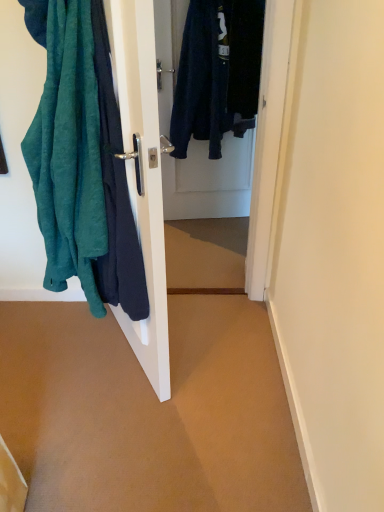
Question: Would you say teal fabric at left is to the left or to the right of dark blue fabric door at center in the picture?

Choices:
 (A) right
 (B) left

Answer: (B)

Question: Is teal fabric at left inside or outside of dark blue fabric door at center?

Choices:
 (A) outside
 (B) inside

Answer: (A)

Question: Is point (152, 357) closer or farther from the camera than point (221, 214)?

Choices:
 (A) closer
 (B) farther

Answer: (A)

Question: From the image's perspective, is dark blue fabric door at center located above or below teal fabric at left?

Choices:
 (A) above
 (B) below

Answer: (A)

Question: Looking at their shapes, would you say dark blue fabric door at center is wider or thinner than teal fabric at left?

Choices:
 (A) wide
 (B) thin

Answer: (B)

Question: Relative to teal fabric at left, is dark blue fabric door at center in front or behind?

Choices:
 (A) front
 (B) behind

Answer: (B)

Question: Is dark blue fabric door at center inside the boundaries of teal fabric at left, or outside?

Choices:
 (A) inside
 (B) outside

Answer: (B)